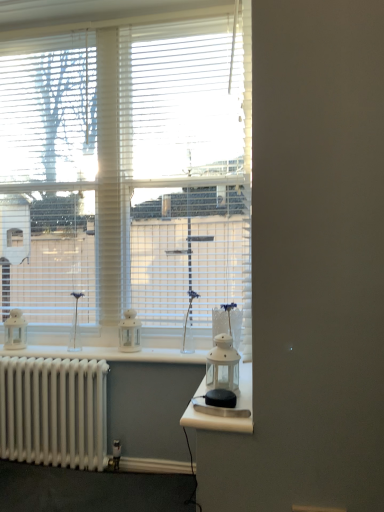
Question: Which direction should I rotate to look at white matte lantern at center, the second appliance in the front-to-back sequence, — up or down?

Choices:
 (A) up
 (B) down

Answer: (B)

Question: Is white blinds at upper center, which ranks as the 1th window in left-to-right order, at the back of white metallic radiator at lower left?

Choices:
 (A) no
 (B) yes

Answer: (A)

Question: Does white metallic radiator at lower left lie behind white blinds at upper center, which ranks as the 1th window in left-to-right order?

Choices:
 (A) no
 (B) yes

Answer: (A)

Question: Is white metallic radiator at lower left aimed at white blinds at upper center, which ranks as the 1th window in left-to-right order?

Choices:
 (A) yes
 (B) no

Answer: (B)

Question: Can you confirm if white metallic radiator at lower left is thinner than white blinds at upper center, which ranks as the 1th window in left-to-right order?

Choices:
 (A) yes
 (B) no

Answer: (A)

Question: From the image's perspective, is white metallic radiator at lower left over white blinds at upper center, marked as the second window in a right-to-left arrangement?

Choices:
 (A) no
 (B) yes

Answer: (A)

Question: From the image's perspective, is white metallic radiator at lower left beneath white blinds at upper center, marked as the second window in a right-to-left arrangement?

Choices:
 (A) no
 (B) yes

Answer: (B)

Question: Is white metallic radiator at lower left oriented towards white plastic blinds at upper left?

Choices:
 (A) yes
 (B) no

Answer: (B)

Question: Is white metallic radiator at lower left wider than white plastic blinds at upper left?

Choices:
 (A) no
 (B) yes

Answer: (B)

Question: Is white metallic radiator at lower left outside of white plastic blinds at upper left?

Choices:
 (A) no
 (B) yes

Answer: (B)

Question: Does white metallic radiator at lower left come behind white plastic blinds at upper left?

Choices:
 (A) no
 (B) yes

Answer: (A)

Question: From the image's perspective, would you say white metallic radiator at lower left is shown under white plastic blinds at upper left?

Choices:
 (A) no
 (B) yes

Answer: (B)

Question: Is white metallic radiator at lower left bigger than white plastic blinds at upper left?

Choices:
 (A) no
 (B) yes

Answer: (A)

Question: From a real-world perspective, is white plastic blinds at upper left on top of white matte window at center, placed as the second window when sorted from left to right?

Choices:
 (A) yes
 (B) no

Answer: (A)